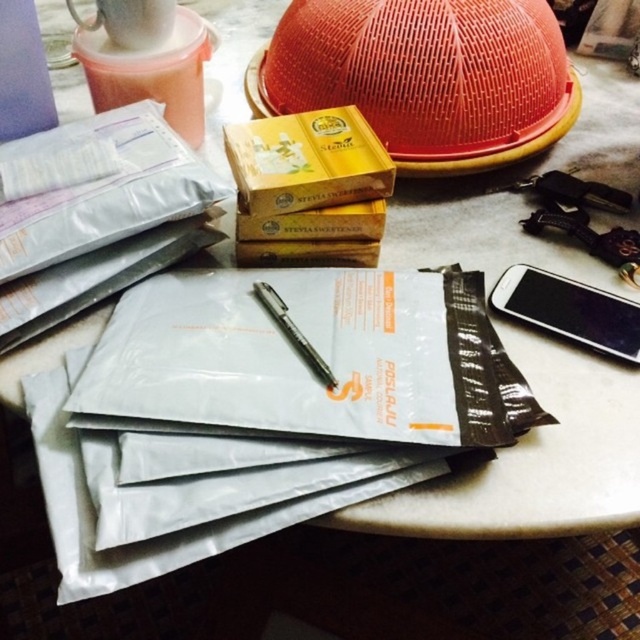
Question: Which object appears closest to the camera in this image?

Choices:
 (A) black metallic pen at center
 (B) black glossy smartphone at right

Answer: (A)

Question: Observing the image, what is the correct spatial positioning of black glossy smartphone at right in reference to black metallic pen at center?

Choices:
 (A) left
 (B) right

Answer: (B)

Question: Which point appears farthest from the camera in this image?

Choices:
 (A) (260, 300)
 (B) (628, 342)

Answer: (A)

Question: Considering the relative positions of black glossy smartphone at right and black metallic pen at center in the image provided, where is black glossy smartphone at right located with respect to black metallic pen at center?

Choices:
 (A) right
 (B) left

Answer: (A)

Question: Which point is closer to the camera?

Choices:
 (A) black metallic pen at center
 (B) black glossy smartphone at right

Answer: (A)

Question: Does black glossy smartphone at right have a lesser width compared to black metallic pen at center?

Choices:
 (A) no
 (B) yes

Answer: (A)